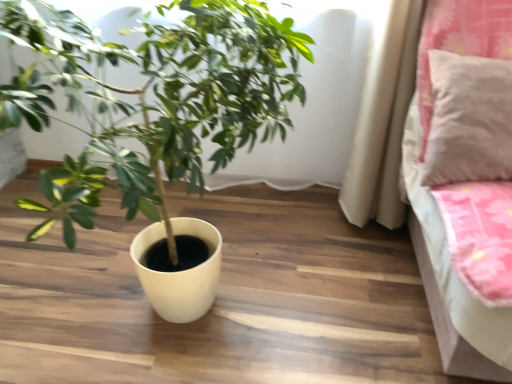
Question: In the image, is pink fabric pillow at upper right positioned in front of or behind matte white pot at center?

Choices:
 (A) behind
 (B) front

Answer: (A)

Question: From their relative heights in the image, would you say pink fabric pillow at upper right is taller or shorter than matte white pot at center?

Choices:
 (A) tall
 (B) short

Answer: (B)

Question: Is pink fabric pillow at upper right situated inside matte white pot at center or outside?

Choices:
 (A) outside
 (B) inside

Answer: (A)

Question: In the image, is matte white pot at center positioned in front of or behind pink fabric pillow at upper right?

Choices:
 (A) behind
 (B) front

Answer: (B)

Question: Considering the positions of matte white pot at center and pink fabric pillow at upper right in the image, is matte white pot at center taller or shorter than pink fabric pillow at upper right?

Choices:
 (A) short
 (B) tall

Answer: (B)

Question: Based on their sizes in the image, would you say matte white pot at center is bigger or smaller than pink fabric pillow at upper right?

Choices:
 (A) small
 (B) big

Answer: (B)

Question: In terms of width, does matte white pot at center look wider or thinner when compared to pink fabric pillow at upper right?

Choices:
 (A) wide
 (B) thin

Answer: (A)